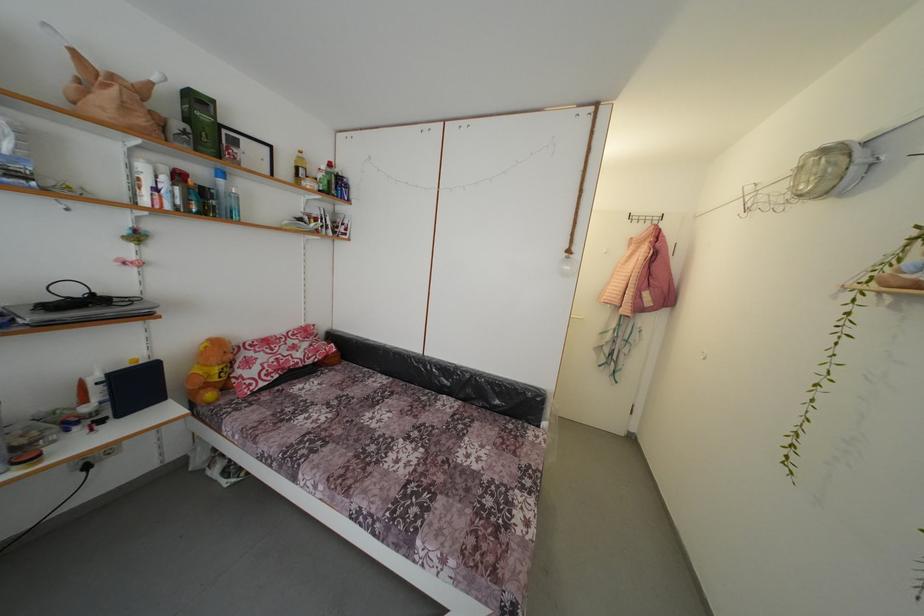
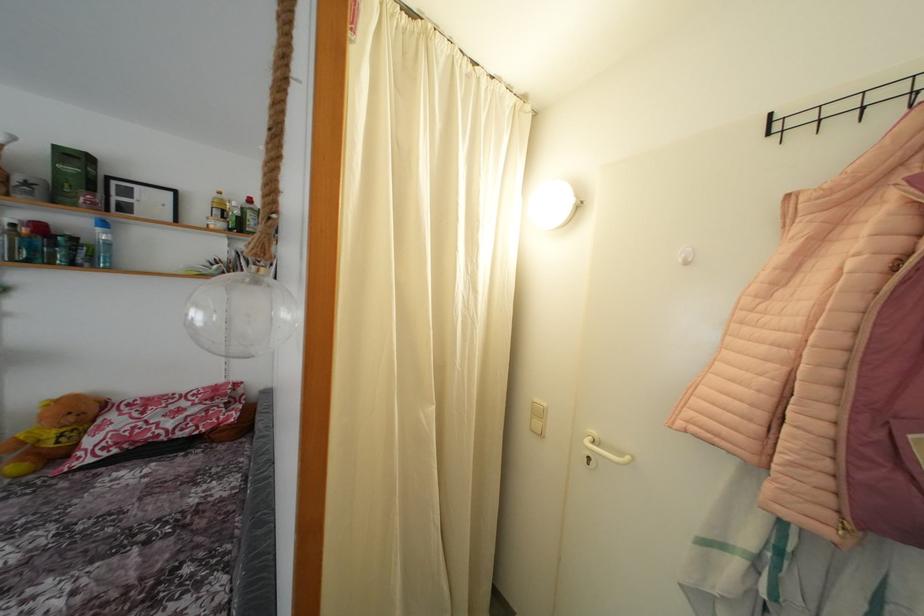
Find the pixel in the second image that matches point 202,107 in the first image.

(80, 163)